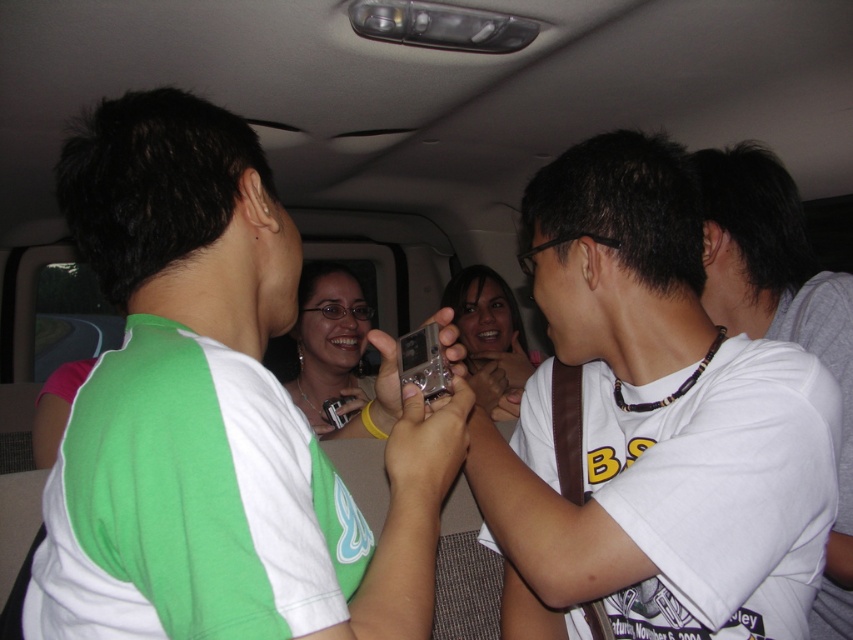
Is white matte shirt at center taller than matte silver phone at center?

Yes, white matte shirt at center is taller than matte silver phone at center.

Is white matte shirt at center below matte silver phone at center?

No, white matte shirt at center is not below matte silver phone at center.

I want to click on white matte shirt at center, so click(x=653, y=426).

Based on the photo, is white matte shirt at upper right to the left of matte silver phone at center from the viewer's perspective?

In fact, white matte shirt at upper right is to the right of matte silver phone at center.

Is point (741, 320) positioned after point (483, 362)?

No.

Image resolution: width=853 pixels, height=640 pixels. In order to click on white matte shirt at upper right in this screenshot , I will do `click(781, 314)`.

Where is `white matte shirt at center`? This screenshot has height=640, width=853. white matte shirt at center is located at coordinates (653, 426).

Can you confirm if white matte shirt at center is smaller than white matte shirt at upper right?

No, white matte shirt at center is not smaller than white matte shirt at upper right.

Is point (723, 532) closer to viewer compared to point (814, 337)?

Yes.

Where is `white matte shirt at center`? This screenshot has width=853, height=640. white matte shirt at center is located at coordinates (653, 426).